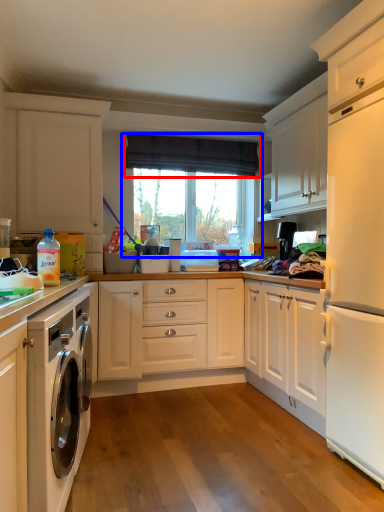
Question: Which of the following is the closest to the observer, curtain (highlighted by a red box) or window (highlighted by a blue box)?

Choices:
 (A) curtain
 (B) window

Answer: (A)